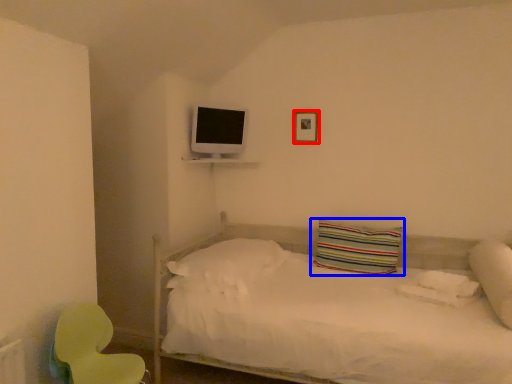
Question: Which object appears closest to the camera in this image, picture frame (highlighted by a red box) or pillow (highlighted by a blue box)?

Choices:
 (A) picture frame
 (B) pillow

Answer: (B)